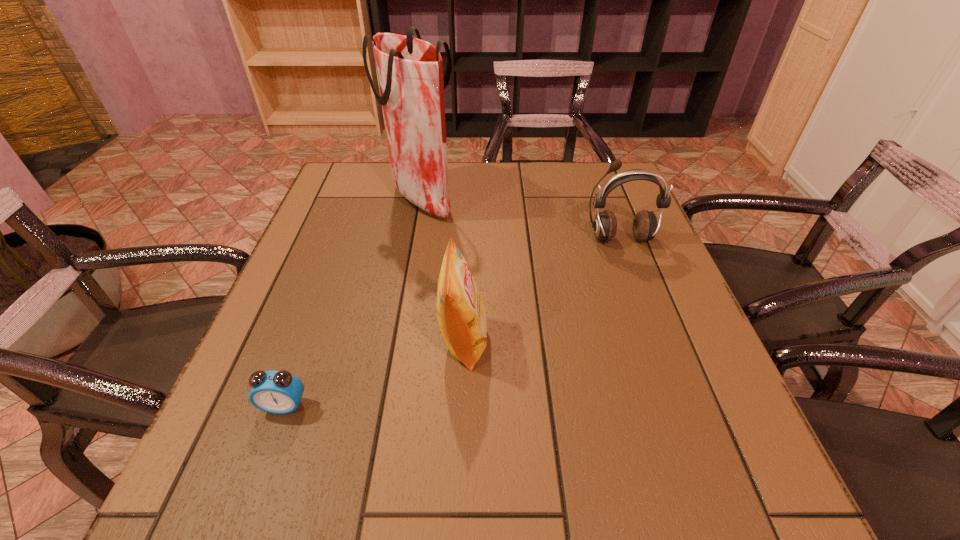
Identify the location of vacant region at the near right corner of the desktop. (734, 471).

The width and height of the screenshot is (960, 540). Identify the location of free space between the crisp (potato chip) and the second farthest object. (541, 290).

Image resolution: width=960 pixels, height=540 pixels. What are the coordinates of `vacant space that is in between the tallest object and the nearest object` in the screenshot? It's located at (352, 302).

The height and width of the screenshot is (540, 960). I want to click on free space that is in between the farthest object and the nearest object, so click(x=352, y=302).

The height and width of the screenshot is (540, 960). Find the location of `vacant space that is in between the shortest object and the tallest object`. vacant space that is in between the shortest object and the tallest object is located at coordinates (352, 302).

Where is `free space between the earphone and the tallest object`? This screenshot has width=960, height=540. free space between the earphone and the tallest object is located at coordinates (520, 219).

This screenshot has height=540, width=960. Find the location of `vacant area that lies between the second nearest object and the earphone`. vacant area that lies between the second nearest object and the earphone is located at coordinates (541, 290).

What are the coordinates of `free space between the grocery bag and the earphone` in the screenshot? It's located at (520, 219).

The image size is (960, 540). I want to click on object that is the second closest to the leftmost object, so click(410, 71).

Choose which object is the second nearest neighbor to the farthest object. Please provide its 2D coordinates. Your answer should be formatted as a tuple, i.e. [(x, y)], where the tuple contains the x and y coordinates of a point satisfying the conditions above.

[(645, 226)]